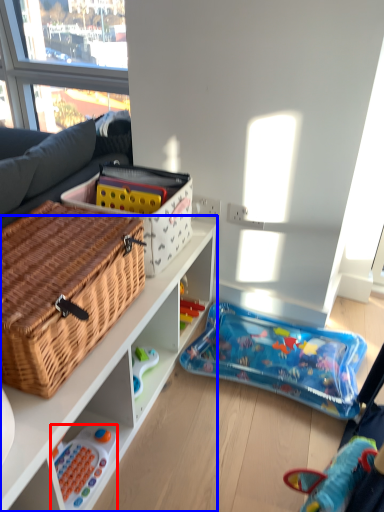
Question: Among these objects, which one is nearest to the camera, toy (highlighted by a red box) or cabinetry (highlighted by a blue box)?

Choices:
 (A) toy
 (B) cabinetry

Answer: (B)